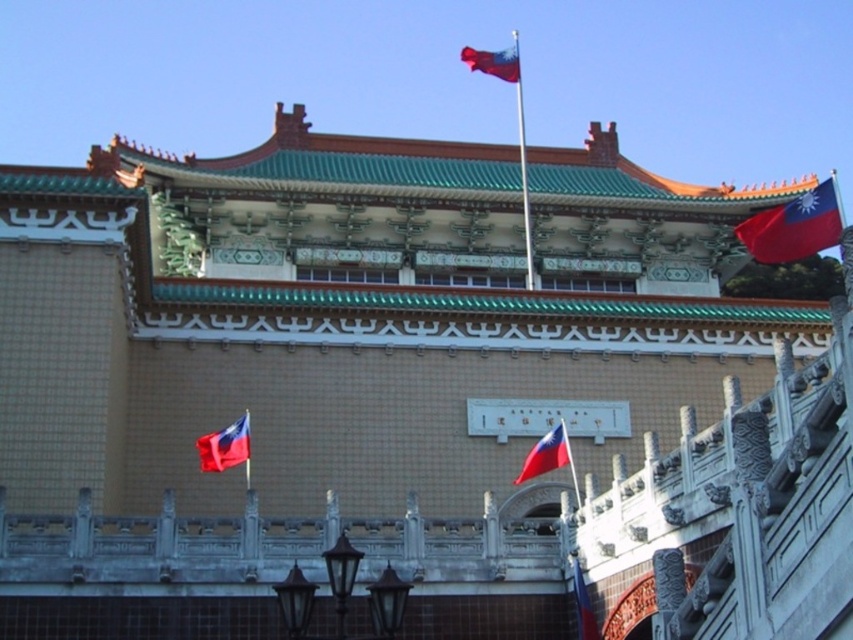
Is red fabric flag at upper right wider than matte red flag at center?

Yes, red fabric flag at upper right is wider than matte red flag at center.

Measure the distance between red fabric flag at upper right and matte red flag at center.

They are 127.01 feet apart.

You are a GUI agent. You are given a task and a screenshot of the screen. Output one action in this format:
    pyautogui.click(x=<x>, y=<y>)
    Task: Click on the red fabric flag at upper right
    This screenshot has height=640, width=853.
    Given the screenshot: What is the action you would take?
    pyautogui.click(x=795, y=225)

Does point (828, 214) lie behind point (524, 221)?

No, (828, 214) is in front of (524, 221).

Is red fabric flag at upper right further to camera compared to polished metal flag pole at center?

That is False.

Which is in front, point (798, 244) or point (532, 257)?

Point (798, 244)

Locate an element on the screen. red fabric flag at upper right is located at coordinates (795, 225).

Can you confirm if red fabric flag at center is thinner than red fabric flag at upper center?

Indeed, red fabric flag at center has a lesser width compared to red fabric flag at upper center.

The width and height of the screenshot is (853, 640). I want to click on red fabric flag at center, so click(x=544, y=454).

Locate an element on the screen. red fabric flag at center is located at coordinates (544, 454).